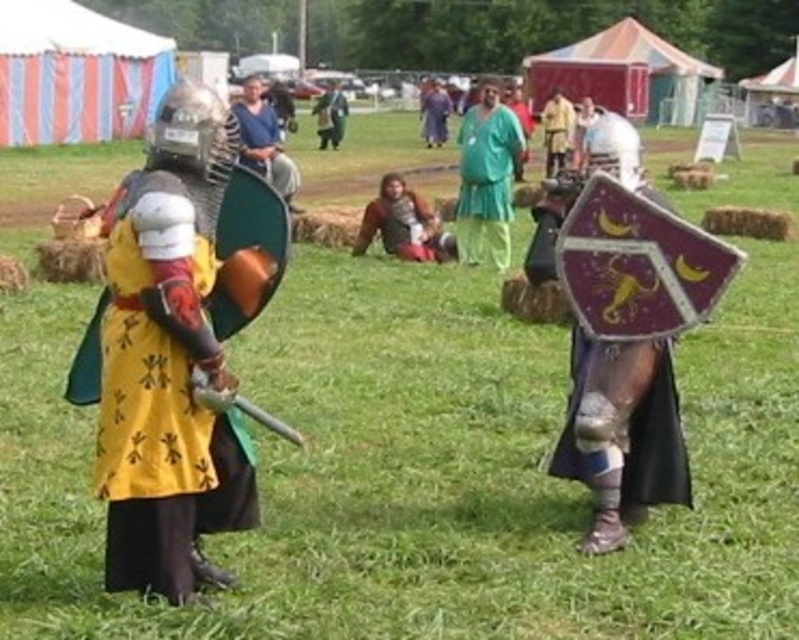
Does yellow fabric tunic at center have a lesser height compared to matte blue tunic at center?

No, yellow fabric tunic at center is not shorter than matte blue tunic at center.

Which is more to the left, yellow fabric tunic at center or matte blue tunic at center?

Positioned to the left is matte blue tunic at center.

Is point (114, 579) more distant than point (260, 161)?

No, (114, 579) is closer to viewer.

You are a GUI agent. You are given a task and a screenshot of the screen. Output one action in this format:
    pyautogui.click(x=<x>, y=<y>)
    Task: Click on the yellow fabric tunic at center
    The width and height of the screenshot is (799, 640).
    Given the screenshot: What is the action you would take?
    click(x=177, y=348)

Consider the image. Does yellow fabric tunic at center have a greater width compared to green fabric pants at center?

Yes, yellow fabric tunic at center is wider than green fabric pants at center.

Consider the image. How far apart are yellow fabric tunic at center and green fabric pants at center?

They are 7.92 meters apart.

Where is `yellow fabric tunic at center`? yellow fabric tunic at center is located at coordinates (177, 348).

Who is positioned more to the right, brown leather armor at center or matte blue tunic at center?

Positioned to the right is brown leather armor at center.

Is point (354, 253) positioned before point (283, 179)?

Yes, point (354, 253) is in front of point (283, 179).

At what (x,y) coordinates should I click in order to perform the action: click on brown leather armor at center. Please return your answer as a coordinate pair (x, y). Image resolution: width=799 pixels, height=640 pixels. Looking at the image, I should click on (403, 225).